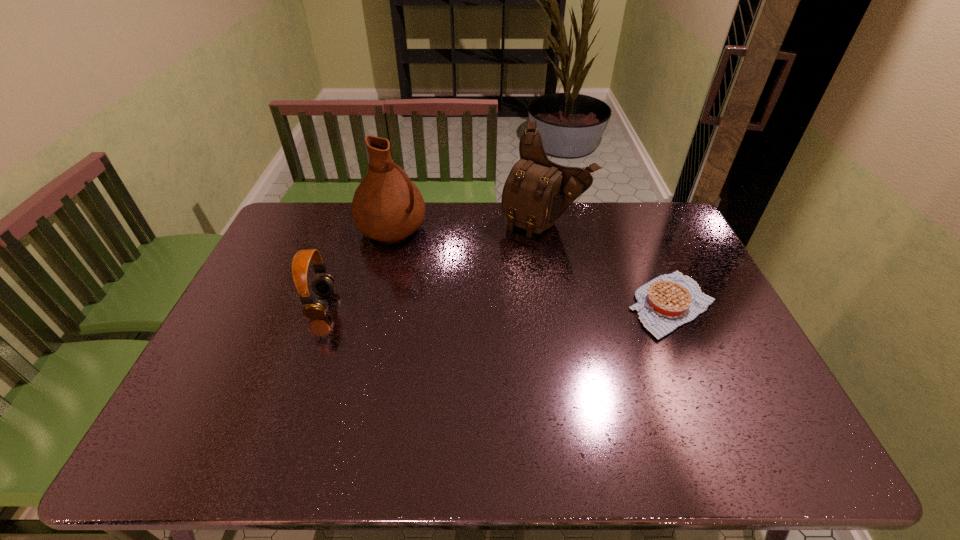
Identify the location of vacant space on the desktop that is between the third tallest object and the shortest object and is positioned on the front-facing side of the second object from right to left. This screenshot has height=540, width=960. (470, 305).

You are a GUI agent. You are given a task and a screenshot of the screen. Output one action in this format:
    pyautogui.click(x=<x>, y=<y>)
    Task: Click on the free space on the desktop that is between the second shortest object and the pie and is positioned on the side of the pitcher with the handle
    The image size is (960, 540).
    Given the screenshot: What is the action you would take?
    pyautogui.click(x=511, y=305)